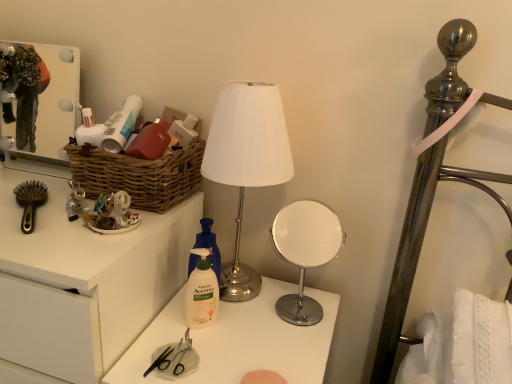
This screenshot has height=384, width=512. Find the location of `free spot in front of white matte lotion at center, marked as the first toiletry in a right-to-left arrangement`. free spot in front of white matte lotion at center, marked as the first toiletry in a right-to-left arrangement is located at coordinates (193, 359).